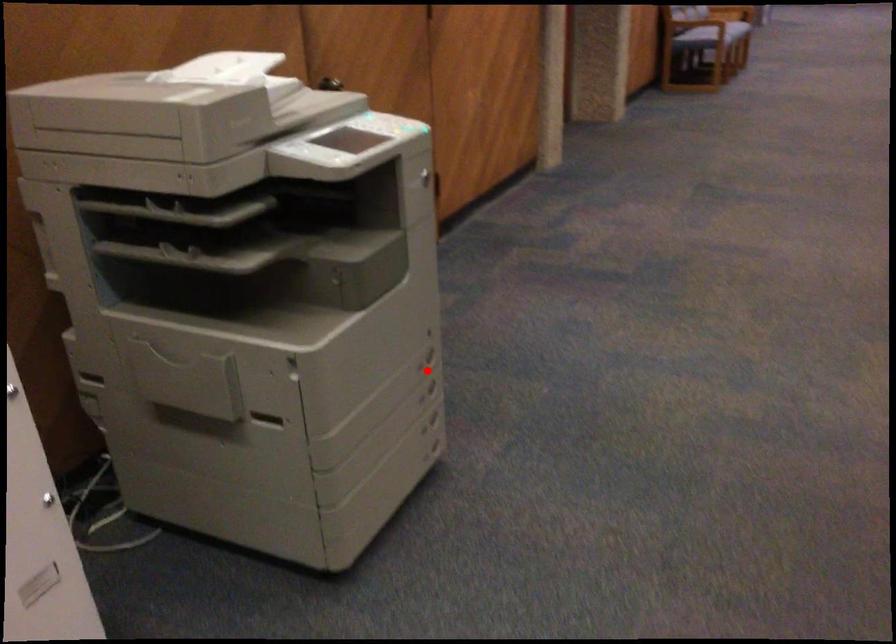
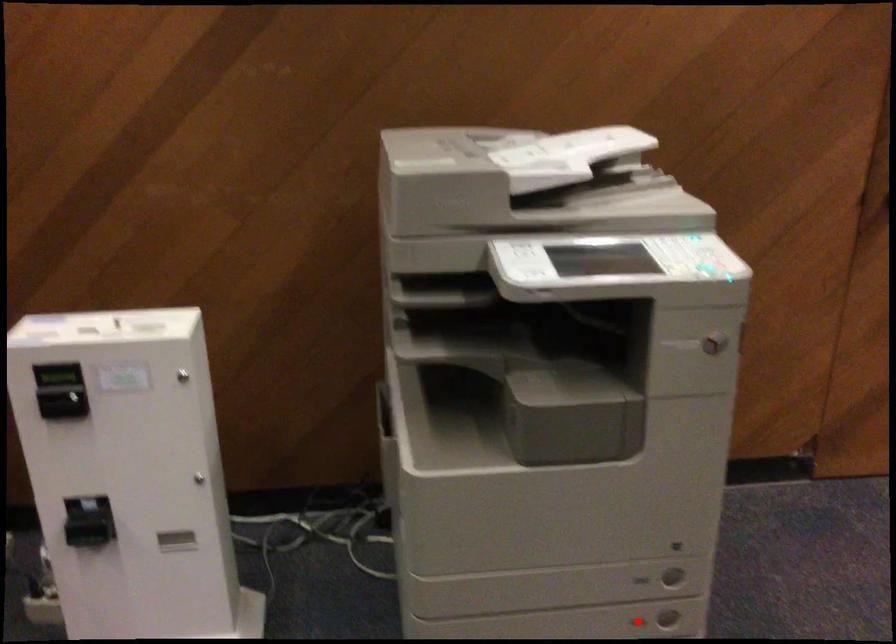
I am providing you with two images of the same scene from different viewpoints. A red point is marked on the first image and another point is marked on the second image. Does the point marked in image1 correspond to the same location as the one in image2?

No